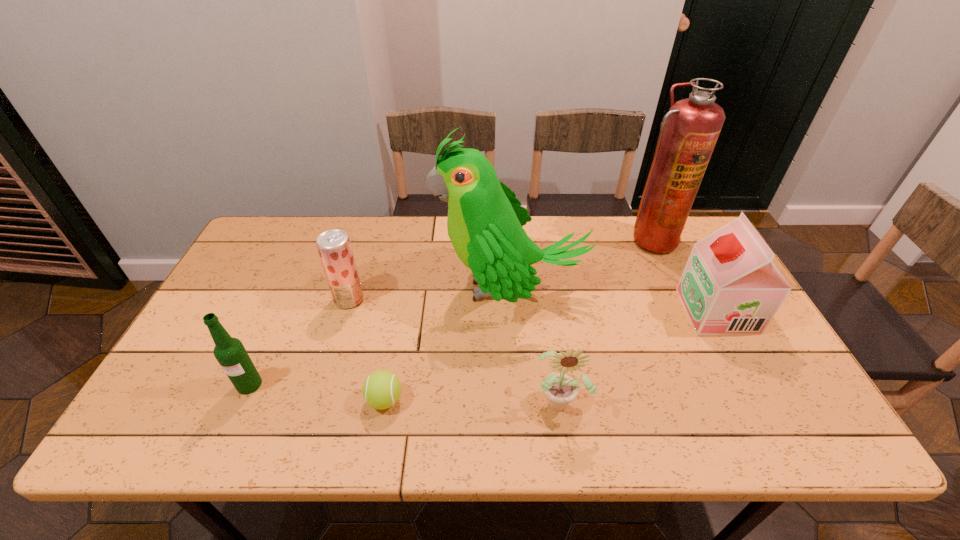
Identify the location of blank space that satisfies the following two spatial constraints: 1. on the side of the fire extinguisher with the label; 2. on the beak of the parakeet. (672, 288).

At what (x,y) coordinates should I click in order to perform the action: click on free space that satisfies the following two spatial constraints: 1. with the cap open on the soya milk; 2. on the label of the beer bottle. Please return your answer as a coordinate pair (x, y). The image size is (960, 540). Looking at the image, I should click on (756, 384).

In order to click on vacant area in the image that satisfies the following two spatial constraints: 1. with the cap open on the soya milk; 2. on the label of the leftmost object in this screenshot , I will do `click(756, 384)`.

Locate an element on the screen. This screenshot has height=540, width=960. free space that satisfies the following two spatial constraints: 1. on the beak of the parakeet; 2. on the label of the beer bottle is located at coordinates (516, 384).